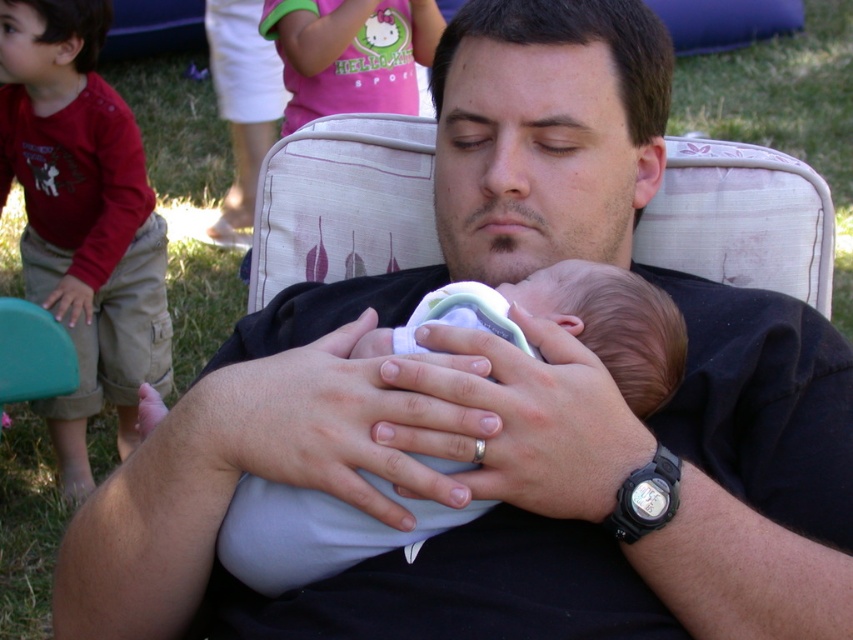
You are standing in front of the scene and want to know how far the point at coordinates (74, 182) is from you. Can you determine the distance?

The point at coordinates (74, 182) is 8.84 feet away from you.

You are a photographer setting up for a family portrait. You need to ensure that both the light blue fabric baby at center and the pink cotton shirt at upper center are clearly visible in the photo. Based on their positions, which object should you focus on first to ensure both are in focus?

The light blue fabric baby at center is in front of the pink cotton shirt at upper center. To ensure both are in focus, you should focus on the pink cotton shirt at upper center first since it is farther away, allowing the depth of field to cover the closer baby as well.

You are helping organize a laundry room and need to determine which of the two cotton shirts is larger. You see the red cotton shirt at left and the pink cotton shirt at upper center. Which one has a larger size?

The red cotton shirt at left is bigger than the pink cotton shirt at upper center, so the red cotton shirt at left is the larger one.